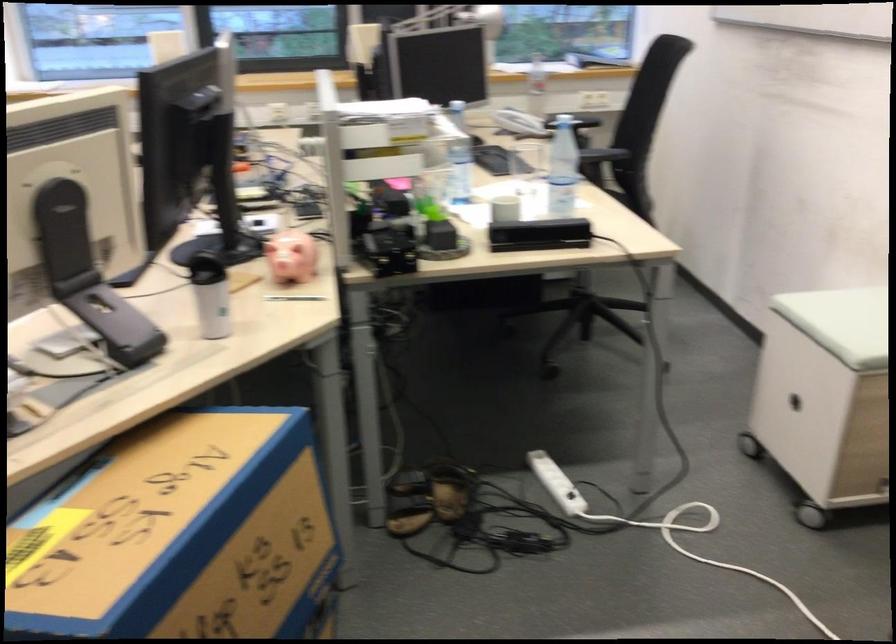
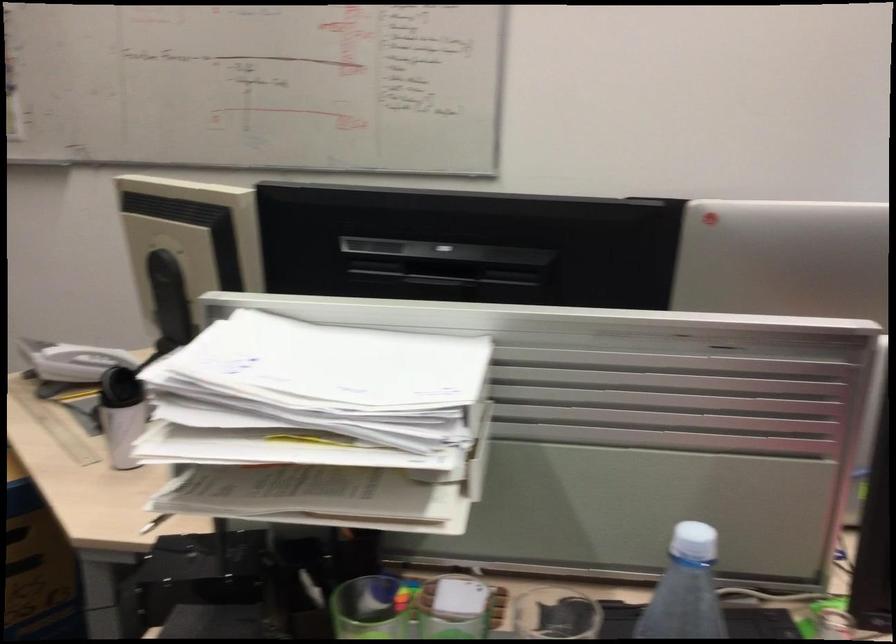
The point at (x=390, y=228) is marked in the first image. Where is the corresponding point in the second image?

(367, 609)